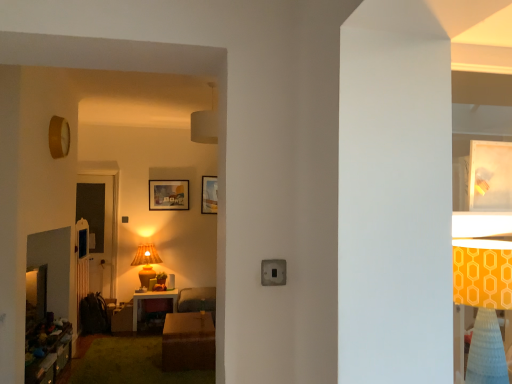
Question: Is matte wooden table at center, arranged as the second table when viewed from the front, in front of or behind metallic silver light switch at center in the image?

Choices:
 (A) front
 (B) behind

Answer: (B)

Question: Is matte wooden table at center, which is counted as the 1th table, starting from the back, taller or shorter than metallic silver light switch at center?

Choices:
 (A) short
 (B) tall

Answer: (B)

Question: Which of these objects is positioned closest to the matte brown table lamp at center?

Choices:
 (A) matte wooden table at center, which is counted as the 1th table, starting from the back
 (B) matte wooden picture frame at center, which is counted as the third picture frame, starting from the right
 (C) orange fabric lampshade at right
 (D) metallic silver light switch at center
 (E) matte wooden picture frame at upper center, which is counted as the 3th picture frame, starting from the front

Answer: (A)

Question: Which is nearer to the matte white picture frame at upper right, acting as the 1th picture frame starting from the front?

Choices:
 (A) matte wooden table at center, the second table when ordered from right to left
 (B) matte brown table lamp at center
 (C) brown wooden table at center, the 1th table in the right-to-left sequence
 (D) orange fabric lampshade at right
 (E) matte wooden picture frame at center, the 2th picture frame positioned from the front

Answer: (D)